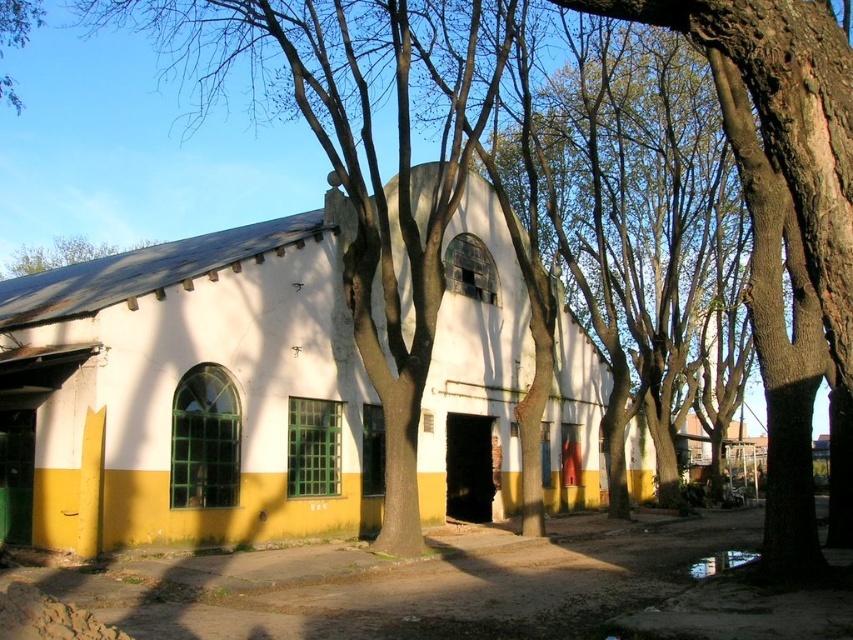
You are a painter planning to paint a landscape that includes both the white matte building at center and the rough bark tree at center. If you want to ensure the building appears larger in the painting than the tree, which object should you place closer to the foreground?

To make the white matte building at center appear larger than the rough bark tree at center in the painting, you should place the white matte building at center closer to the foreground since objects closer to the viewer appear larger.

You are standing in front of a rustic building and a tree. The building has a white upper part and yellow lower part. You want to take a photo that includes both the white matte building at center and the rough bark tree at center. Which one should you zoom in more on to ensure both fit in the frame?

Since the white matte building at center is larger than the rough bark tree at center, you should zoom in more on the rough bark tree at center to ensure both fit in the frame.